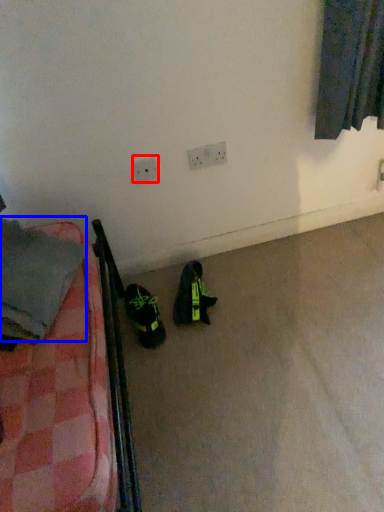
Question: Among these objects, which one is nearest to the camera, electric outlet (highlighted by a red box) or clothing (highlighted by a blue box)?

Choices:
 (A) electric outlet
 (B) clothing

Answer: (B)